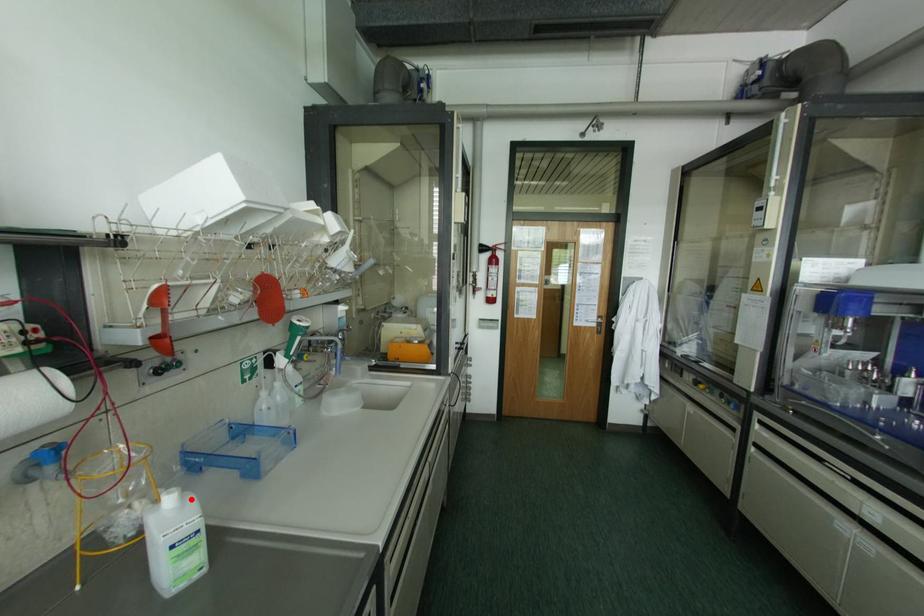
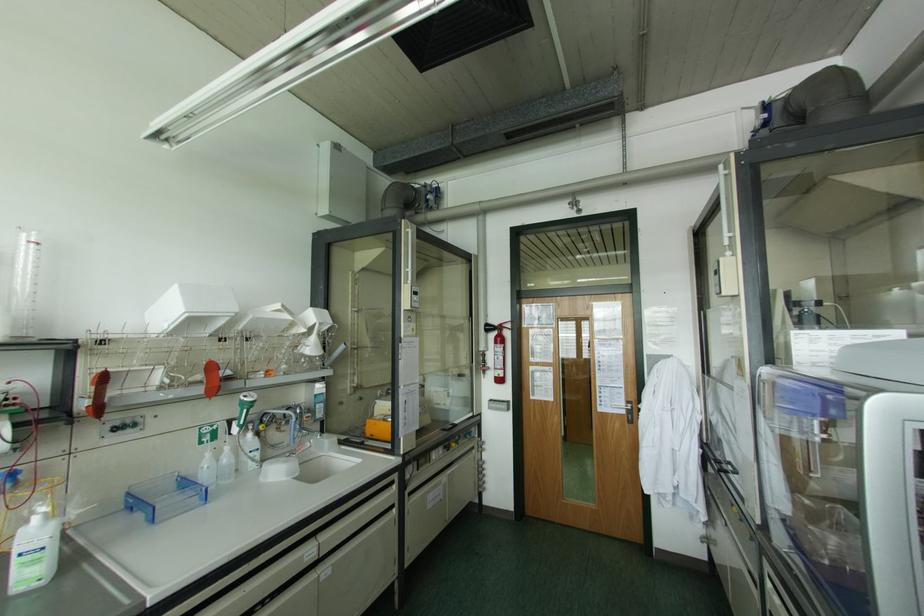
In the second image, find the point that corresponds to the highlighted location in the first image.

(53, 523)